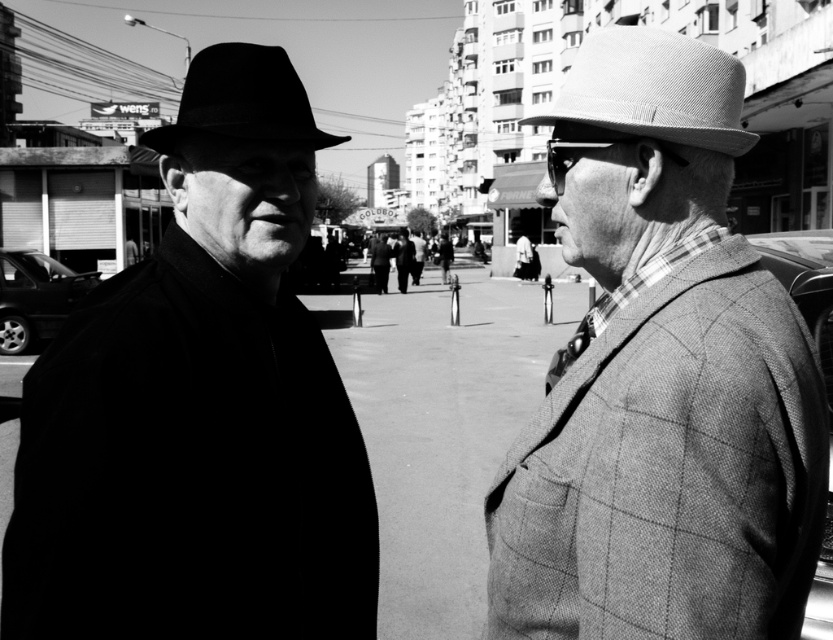
You are a photographer trying to capture the plaid wool jacket at right in the image. Based on its 2D coordinates, where should you focus your camera to ensure the jacket is centered in the frame?

To center the plaid wool jacket at right in the frame, focus the camera at the 2D coordinates point (661, 378) since that is where the plaid wool jacket at right is located.

You are a photographer analyzing this black and white photo. You notice the textured gray cowboy hat at upper right in the scene. Based on its position coordinates, where exactly would you say it is located in relation to the two men?

The textured gray cowboy hat at upper right is located at point coordinates of (652, 90), which places it in the upper right corner of the image, above and to the right of the two men engaged in conversation.

In the scene shown: You are a fashion designer observing the two men in the image. You need to determine the spatial relationship between the plaid wool jacket at right and the textured gray cowboy hat at upper right. Which object is located to the left of the other?

The plaid wool jacket at right is positioned on the left side of textured gray cowboy hat at upper right, meaning the jacket is to the left of the hat.